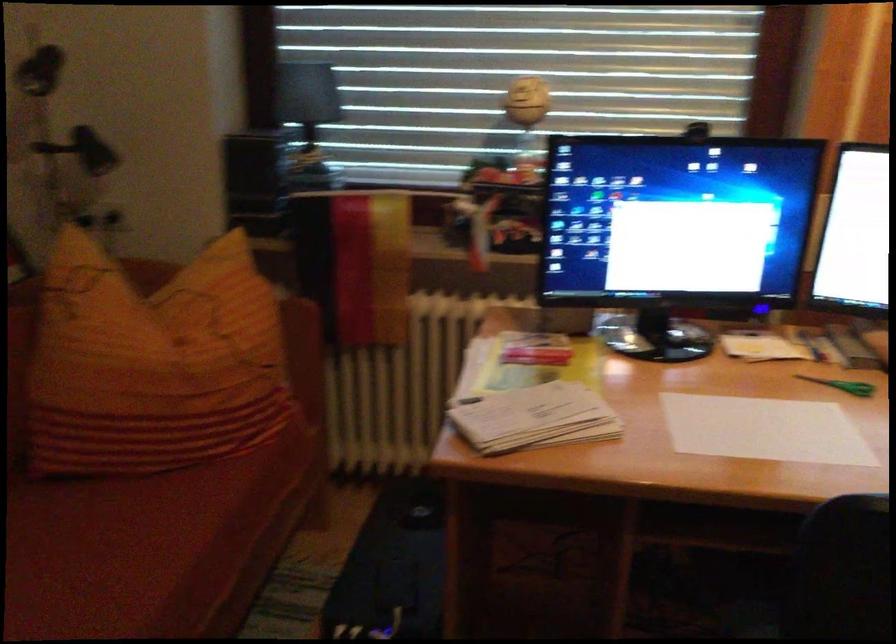
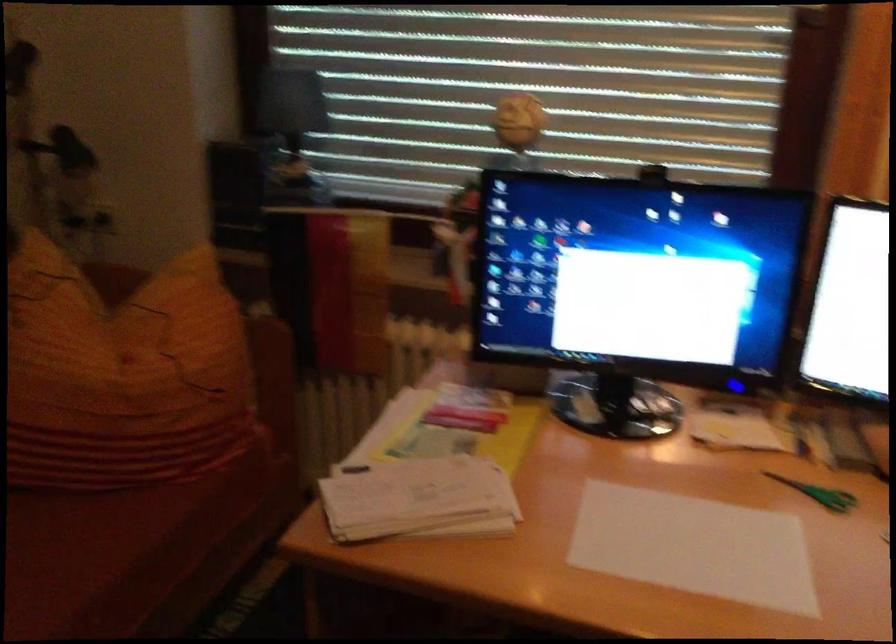
Based on the photo, which direction would the cameraman need to move to produce the second image?

The cameraman moved toward right, forward.